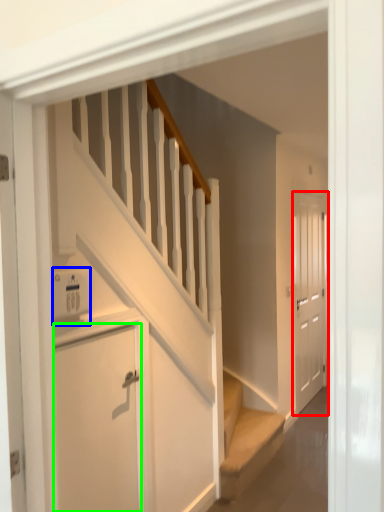
Question: Which is farther away from door (highlighted by a red box)? appliance (highlighted by a blue box) or door (highlighted by a green box)?

Choices:
 (A) appliance
 (B) door

Answer: (A)